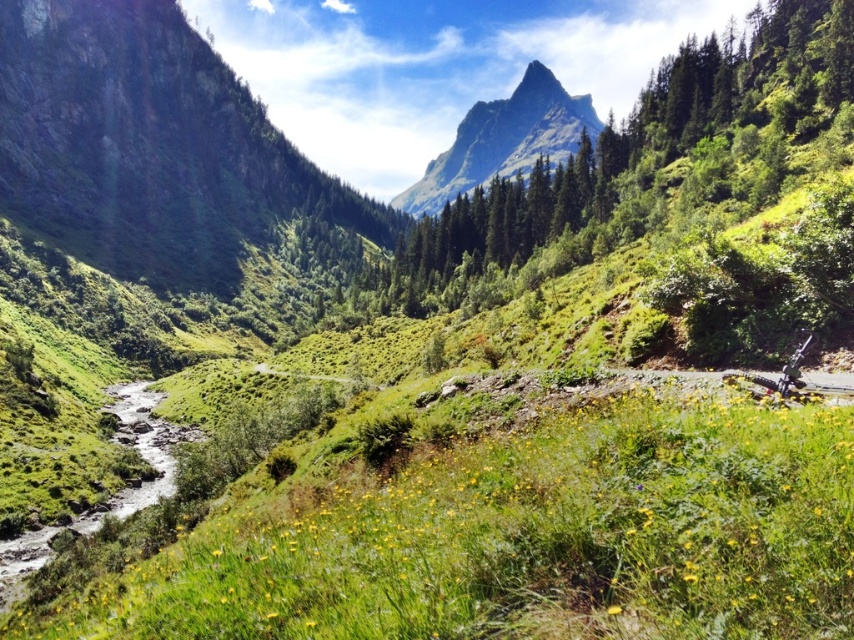
Which is below, green rocky mountain at left or rugged granite peak at upper center?

Positioned lower is green rocky mountain at left.

Between green rocky mountain at left and rugged granite peak at upper center, which one has less height?

green rocky mountain at left is shorter.

Does point (132, 136) come farther from viewer compared to point (437, 195)?

No, it is not.

You are a GUI agent. You are given a task and a screenshot of the screen. Output one action in this format:
    pyautogui.click(x=<x>, y=<y>)
    Task: Click on the green rocky mountain at left
    
    Given the screenshot: What is the action you would take?
    pyautogui.click(x=149, y=145)